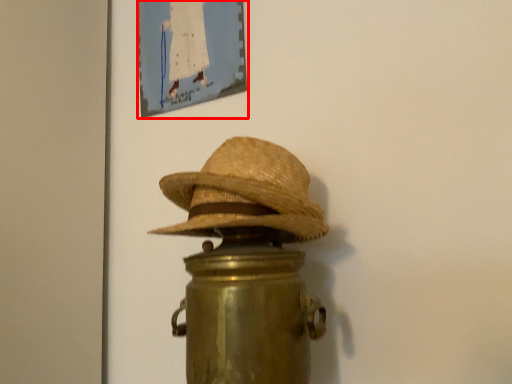
Question: From the image's perspective, what is the correct spatial relationship of picture frame (annotated by the red box) in relation to cowboy hat?

Choices:
 (A) above
 (B) below

Answer: (A)